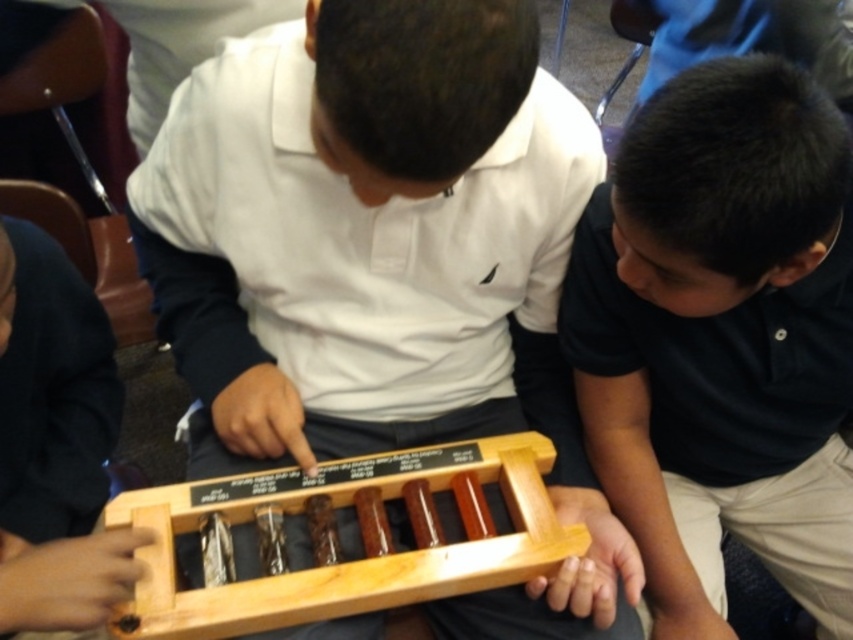
Measure the distance between point (242, 285) and camera.

A distance of 37.22 inches exists between point (242, 285) and camera.

Who is more distant from viewer, (166, 236) or (653, 339)?

The point (166, 236) is more distant.

Is point (259, 344) more distant than point (680, 204)?

Yes, point (259, 344) is behind point (680, 204).

At what (x,y) coordinates should I click in order to perform the action: click on wooden tray at center. Please return your answer as a coordinate pair (x, y). The height and width of the screenshot is (640, 853). Looking at the image, I should click on (363, 228).